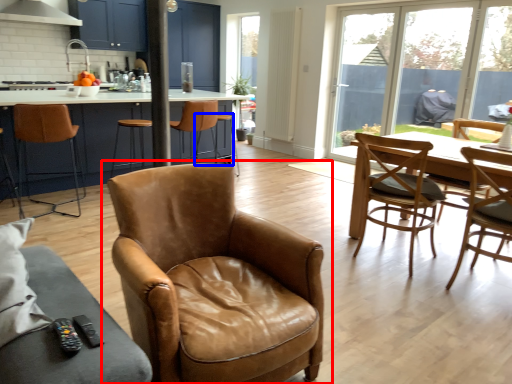
Question: Which object is closer to the camera taking this photo, chair (highlighted by a red box) or bar stool (highlighted by a blue box)?

Choices:
 (A) chair
 (B) bar stool

Answer: (A)